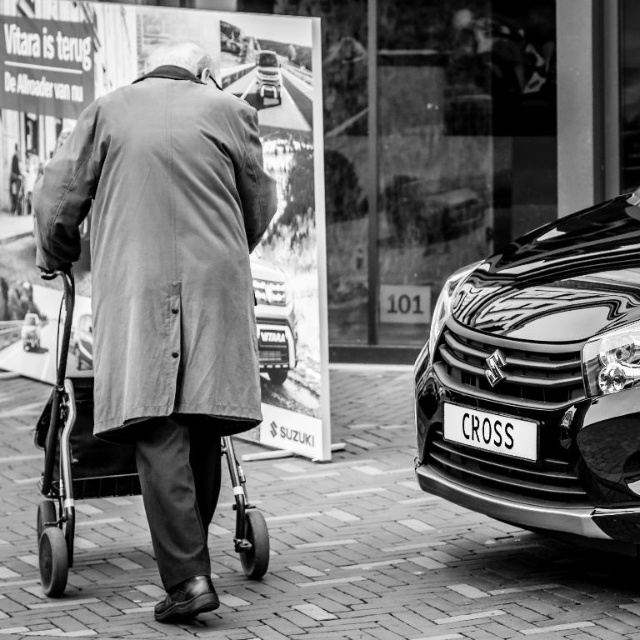
You are standing at the camera position and want to cross the street. There is a black glossy car at right represented by point (540, 380). Where should you look first for safety?

You should look towards the black glossy car at right represented by point (540, 380) first for safety because it is the closest vehicle in your line of sight.

Consider the image. You are a pedestrian standing at the intersection and see the shiny metallic car at center and the white plastic license plate at lower right. Which object is closer to the right side of the image?

The white plastic license plate at lower right is closer to the right side of the image because the shiny metallic car at center is to the left of it.

Based on the scene description, where is the matte gray coat at center located in the image?

The matte gray coat at center is located at the 2D coordinates point (166, 289) in the image.